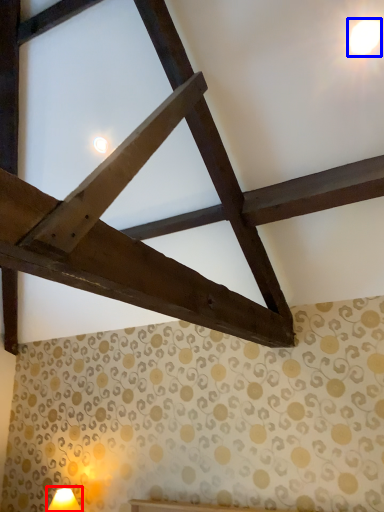
Question: Among these objects, which one is nearest to the camera, table lamp (highlighted by a red box) or light (highlighted by a blue box)?

Choices:
 (A) table lamp
 (B) light

Answer: (B)